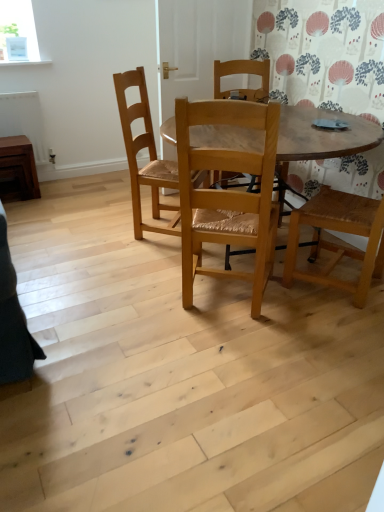
Question: Is point (29, 184) closer or farther from the camera than point (200, 178)?

Choices:
 (A) farther
 (B) closer

Answer: (A)

Question: From the image's perspective, is brown wooden side table at left above or below natural wood chair at center, positioned as the 2th chair in front-to-back order?

Choices:
 (A) below
 (B) above

Answer: (B)

Question: Estimate the real-world distances between objects in this image. Which object is farther from the wooden table at center?

Choices:
 (A) brown wooden radiator at left
 (B) natural wood chair at center, which is counted as the first chair, starting from the back
 (C) natural wood chair at center, the 1th chair in the front-to-back sequence
 (D) brown wooden side table at left

Answer: (A)

Question: Estimate the real-world distances between objects in this image. Which object is closer to the natural wood chair at center, which is counted as the first chair, starting from the back?

Choices:
 (A) natural wood chair at center, the 1th chair in the front-to-back sequence
 (B) brown wooden radiator at left
 (C) brown wooden side table at left
 (D) wooden table at center

Answer: (A)